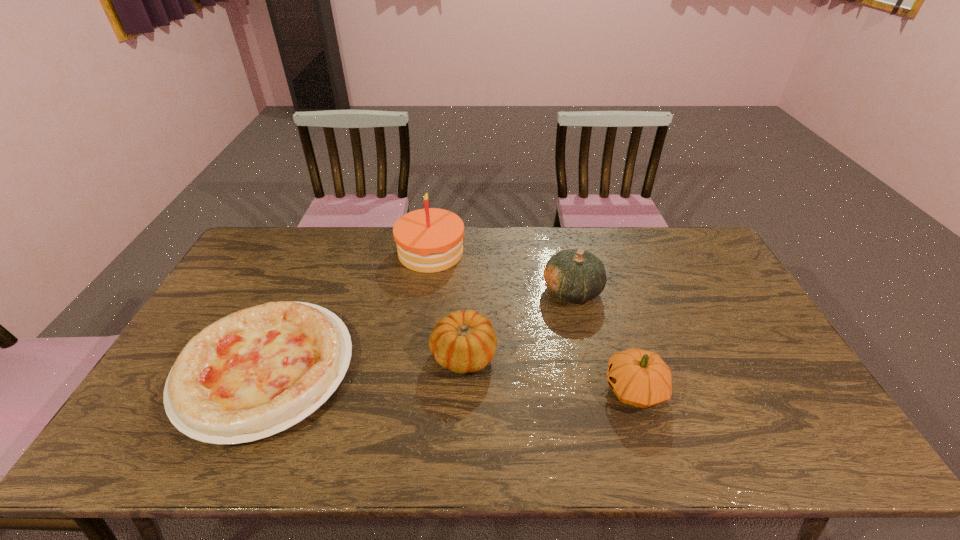
This screenshot has height=540, width=960. In order to click on free space between the farthest gourd and the leftmost gourd in this screenshot , I will do (x=517, y=322).

I want to click on vacant space that is in between the pizza and the leftmost gourd, so coord(365,362).

Where is `the closest object relative to the leftmost object`? The height and width of the screenshot is (540, 960). the closest object relative to the leftmost object is located at coordinates 429,240.

This screenshot has width=960, height=540. Identify the location of object that is the fourth nearest to the birthday cake. (638, 377).

The image size is (960, 540). I want to click on gourd that is the closest to the pizza, so click(x=464, y=341).

Point out which gourd is positioned as the nearest to the leftmost gourd. Please provide its 2D coordinates. Your answer should be formatted as a tuple, i.e. [(x, y)], where the tuple contains the x and y coordinates of a point satisfying the conditions above.

[(574, 275)]

Where is `blank space that satisfies the following two spatial constraints: 1. on the back side of the leftmost gourd; 2. on the left side of the leftmost object`? blank space that satisfies the following two spatial constraints: 1. on the back side of the leftmost gourd; 2. on the left side of the leftmost object is located at coordinates [x=273, y=354].